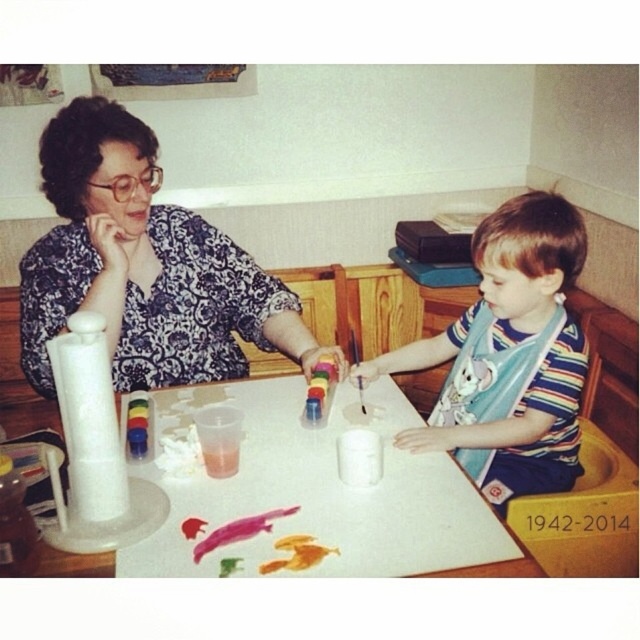
Question: Where is floral-patterned blouse at upper left located in relation to pastel matte crayon at center in the image?

Choices:
 (A) below
 (B) above

Answer: (B)

Question: Can you confirm if floral-patterned blouse at upper left is positioned to the right of white paper at center?

Choices:
 (A) no
 (B) yes

Answer: (B)

Question: Which object appears closest to the camera in this image?

Choices:
 (A) striped cotton shirt at center
 (B) pastel matte crayon at center

Answer: (A)

Question: Considering the real-world distances, which object is farthest from the floral-patterned blouse at upper left?

Choices:
 (A) white paper at center
 (B) pastel matte crayon at center
 (C) striped cotton shirt at center

Answer: (C)

Question: Which object is closer to the camera taking this photo?

Choices:
 (A) pastel matte crayon at center
 (B) white paper at center
 (C) striped cotton shirt at center

Answer: (C)

Question: Does floral-patterned blouse at upper left have a larger size compared to white paper at center?

Choices:
 (A) no
 (B) yes

Answer: (B)